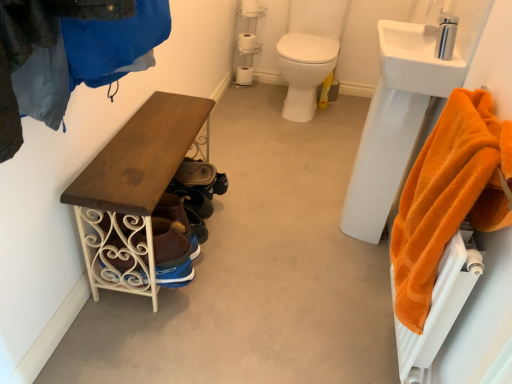
Identify the location of vacant point to the right of wooden bench at left. (277, 256).